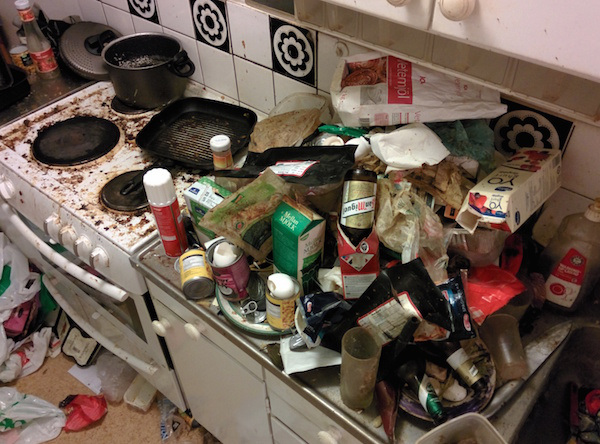
Identify the location of oven burners. This screenshot has height=444, width=600. (x=125, y=184), (x=78, y=146), (x=130, y=111).